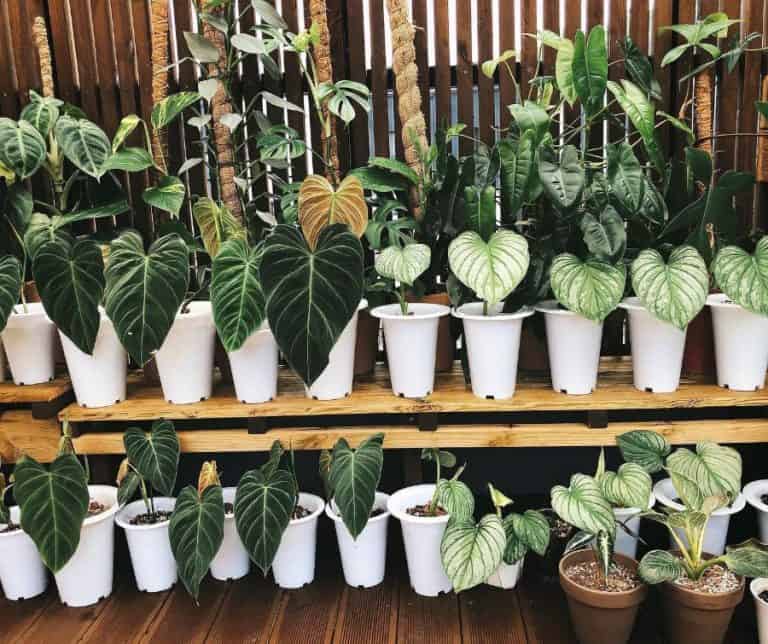
Find the location of a particular element. The height and width of the screenshot is (644, 768). pot is located at coordinates (581, 368).